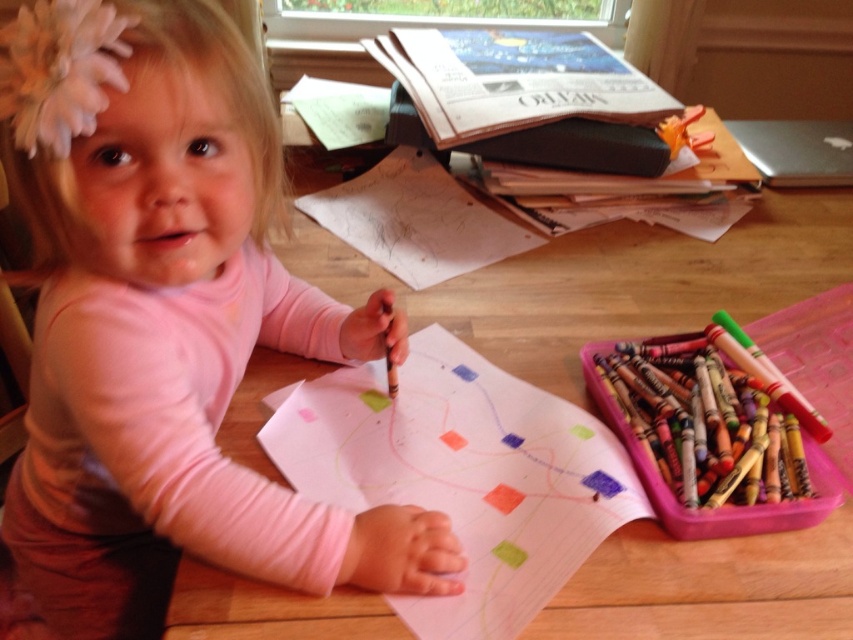
Which is behind, point (463, 376) or point (724, 342)?

Point (463, 376)

The height and width of the screenshot is (640, 853). What are the coordinates of `smooth white paper at center` in the screenshot? It's located at (461, 474).

Find the location of a particular element. The height and width of the screenshot is (640, 853). smooth white paper at center is located at coordinates (461, 474).

Between wooden table at center and smooth white paper at center, which one is positioned lower?

Positioned lower is smooth white paper at center.

Between point (540, 298) and point (555, 433), which one is positioned behind?

The point (540, 298) is more distant.

You are a GUI agent. You are given a task and a screenshot of the screen. Output one action in this format:
    pyautogui.click(x=<x>, y=<y>)
    Task: Click on the wooden table at center
    The height and width of the screenshot is (640, 853).
    Given the screenshot: What is the action you would take?
    pyautogui.click(x=606, y=282)

Does matte pink shirt at center have a greater height compared to wooden table at center?

No, matte pink shirt at center is not taller than wooden table at center.

Who is more distant from viewer, (242, 156) or (773, 545)?

The point (773, 545) is more distant.

The image size is (853, 640). I want to click on matte pink shirt at center, so click(167, 324).